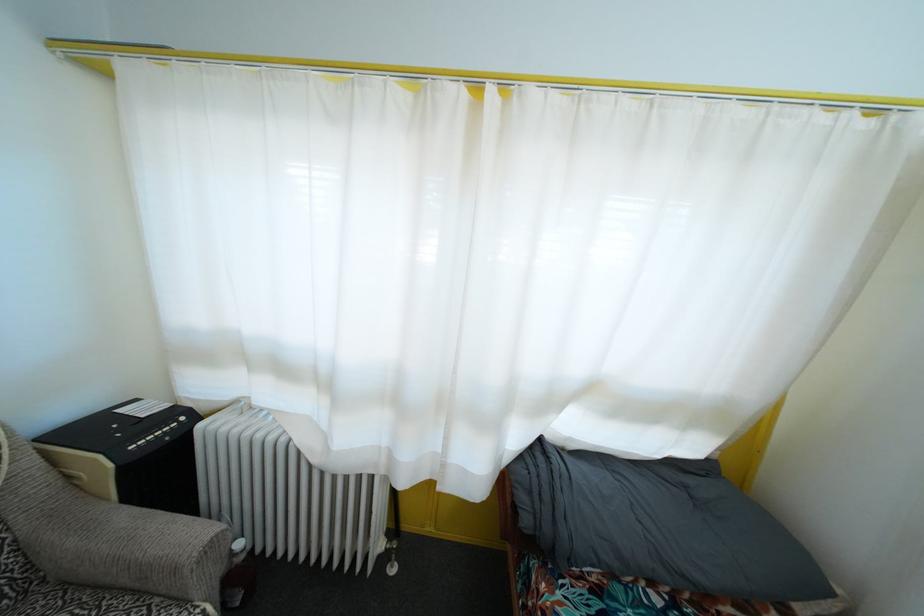
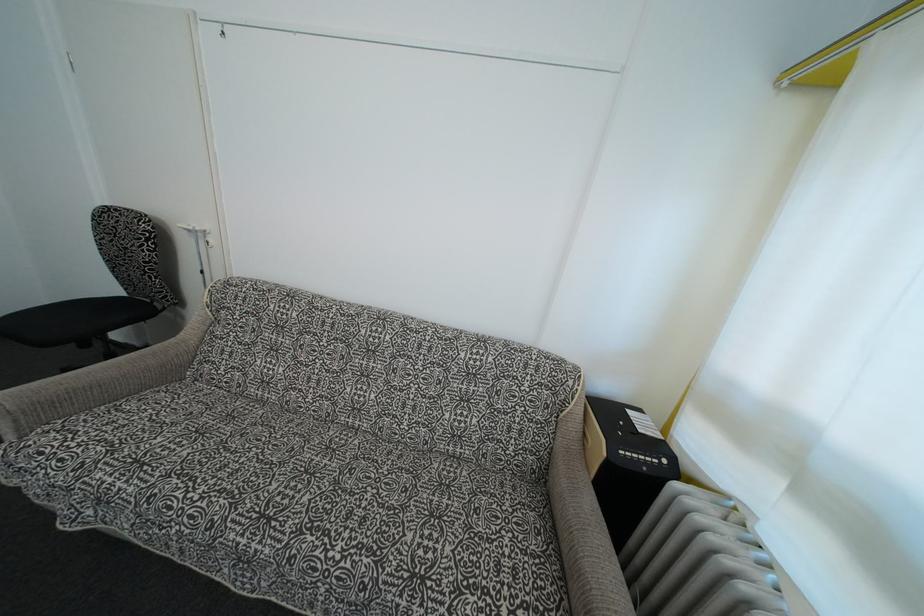
Question: Based on the continuous images, in which direction is the camera rotating? Reply with the corresponding letter.

Choices:
 (A) Left
 (B) Right
 (C) Up
 (D) Down

Answer: (A)